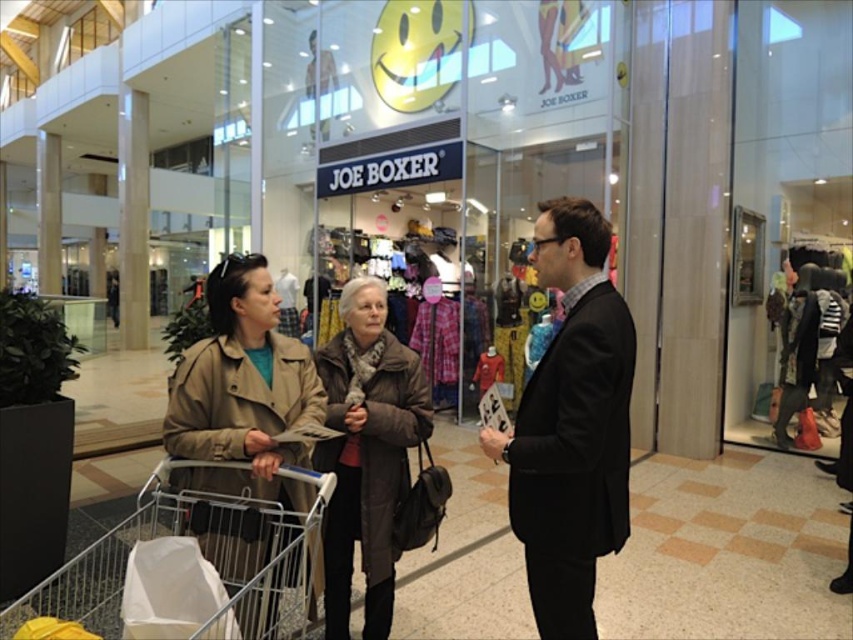
Question: Which of the following is the closest to the observer?

Choices:
 (A) black suit at center
 (B) striped sweater at center
 (C) brown fuzzy coat at center
 (D) metallic silver shopping cart at lower left

Answer: (D)

Question: Which is farther from the brown fuzzy coat at center?

Choices:
 (A) tan leather coat at lower left
 (B) metallic silver shopping cart at lower left

Answer: (B)

Question: Based on their relative distances, which object is nearer to the tan leather coat at lower left?

Choices:
 (A) striped sweater at center
 (B) black suit at center
 (C) metallic silver shopping cart at lower left
 (D) brown fuzzy coat at center

Answer: (C)

Question: Does tan leather coat at lower left lie behind metallic silver shopping cart at lower left?

Choices:
 (A) no
 (B) yes

Answer: (B)

Question: Considering the relative positions of black suit at center and striped sweater at center in the image provided, where is black suit at center located with respect to striped sweater at center?

Choices:
 (A) above
 (B) below

Answer: (A)

Question: Is tan leather coat at lower left positioned before metallic silver shopping cart at lower left?

Choices:
 (A) yes
 (B) no

Answer: (B)